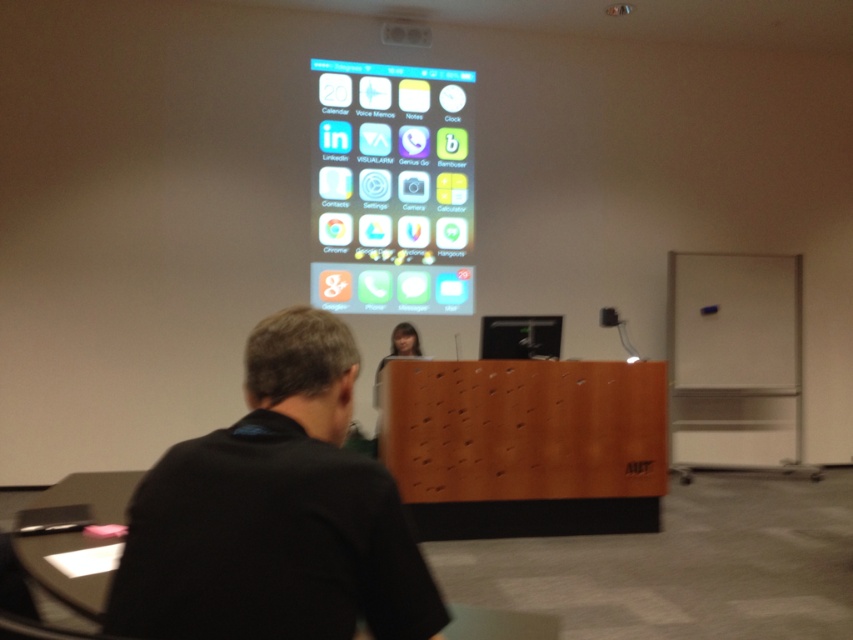
Question: Which of the following is the farthest from the observer?

Choices:
 (A) matte glass phone at upper center
 (B) black glossy computer screen at center

Answer: (A)

Question: Which of the following is the farthest from the observer?

Choices:
 (A) (405, 92)
 (B) (314, 612)
 (C) (541, 333)

Answer: (A)

Question: Is black fabric shirt at center smaller than matte glass phone at upper center?

Choices:
 (A) yes
 (B) no

Answer: (A)

Question: Is black fabric shirt at center behind black glossy computer screen at center?

Choices:
 (A) yes
 (B) no

Answer: (B)

Question: Which point appears farthest from the camera in this image?

Choices:
 (A) (486, 332)
 (B) (373, 132)
 (C) (271, 445)

Answer: (B)

Question: Is matte glass phone at upper center to the left of black glossy computer screen at center from the viewer's perspective?

Choices:
 (A) yes
 (B) no

Answer: (A)